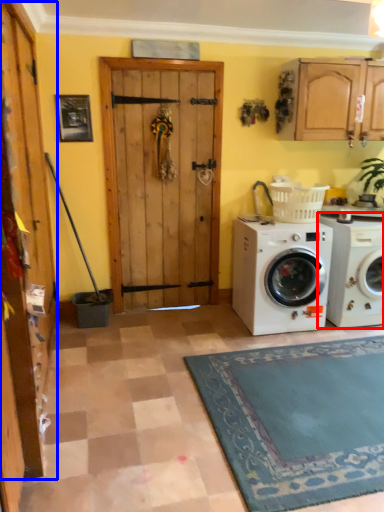
Question: Which object is further to the camera taking this photo, washing machine (highlighted by a red box) or barn door (highlighted by a blue box)?

Choices:
 (A) washing machine
 (B) barn door

Answer: (A)